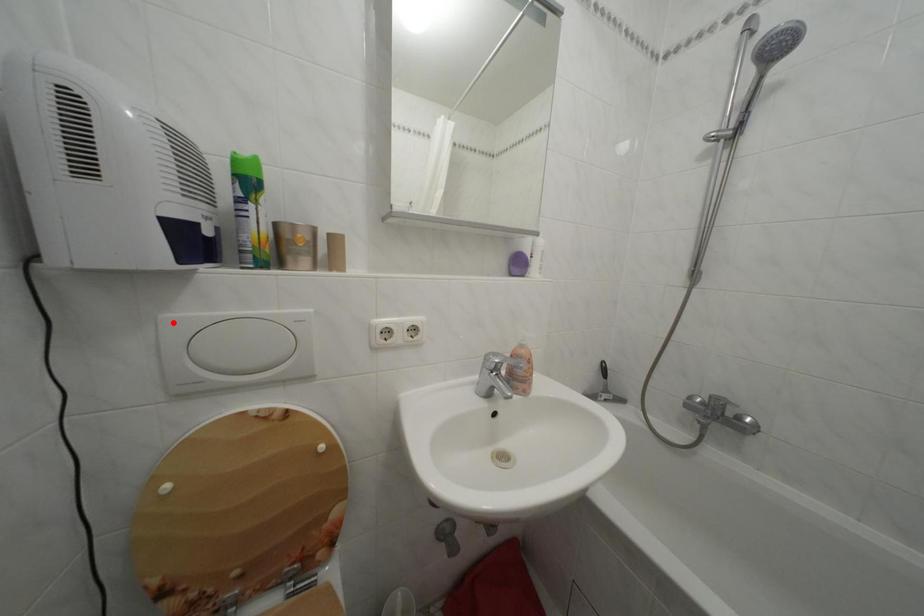
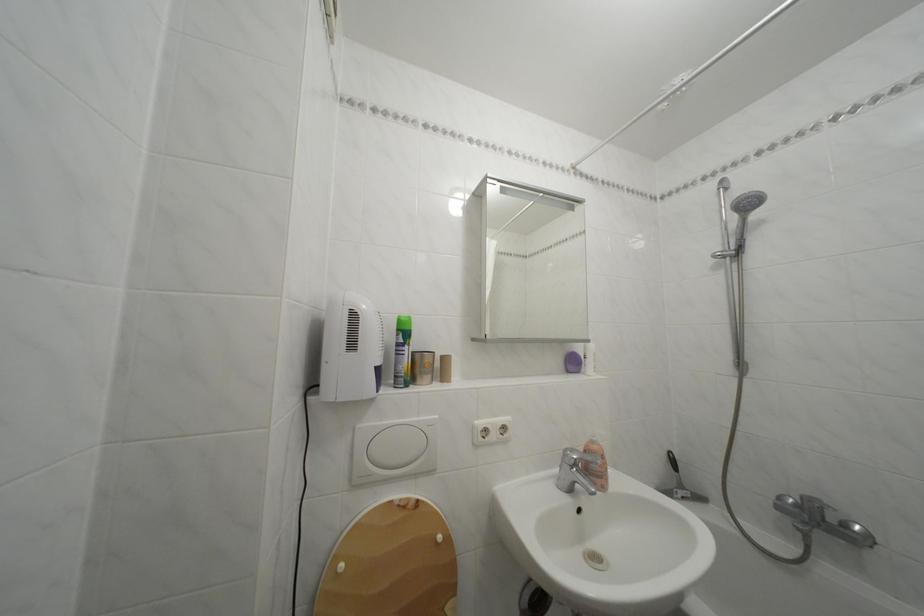
Locate, in the second image, the point that corresponds to the highlighted location in the first image.

(368, 432)